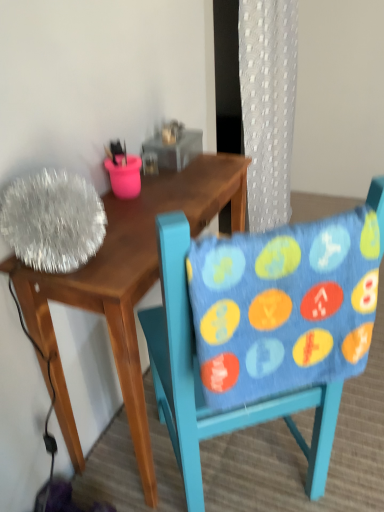
Question: From the image's perspective, would you say blue fabric pillow at center is shown under blue fabric chair at center?

Choices:
 (A) yes
 (B) no

Answer: (B)

Question: Would you say blue fabric pillow at center is outside blue fabric chair at center?

Choices:
 (A) yes
 (B) no

Answer: (B)

Question: Is blue fabric pillow at center turned away from blue fabric chair at center?

Choices:
 (A) yes
 (B) no

Answer: (A)

Question: Does blue fabric pillow at center have a greater width compared to blue fabric chair at center?

Choices:
 (A) yes
 (B) no

Answer: (B)

Question: Can blue fabric chair at center be found inside blue fabric pillow at center?

Choices:
 (A) no
 (B) yes

Answer: (A)

Question: Does blue fabric pillow at center appear on the left side of blue fabric chair at center?

Choices:
 (A) no
 (B) yes

Answer: (A)

Question: Is blue fabric pillow at center completely or partially outside of wooden desk at left?

Choices:
 (A) yes
 (B) no

Answer: (A)

Question: Is wooden desk at left located within blue fabric pillow at center?

Choices:
 (A) yes
 (B) no

Answer: (B)

Question: Is blue fabric pillow at center to the right of wooden desk at left from the viewer's perspective?

Choices:
 (A) no
 (B) yes

Answer: (B)

Question: Is blue fabric pillow at center at the left side of wooden desk at left?

Choices:
 (A) yes
 (B) no

Answer: (B)

Question: Can you confirm if blue fabric pillow at center is shorter than wooden desk at left?

Choices:
 (A) yes
 (B) no

Answer: (A)

Question: Is blue fabric pillow at center facing away from wooden desk at left?

Choices:
 (A) no
 (B) yes

Answer: (A)

Question: Does blue fabric chair at center have a smaller size compared to blue fabric pillow at center?

Choices:
 (A) yes
 (B) no

Answer: (B)